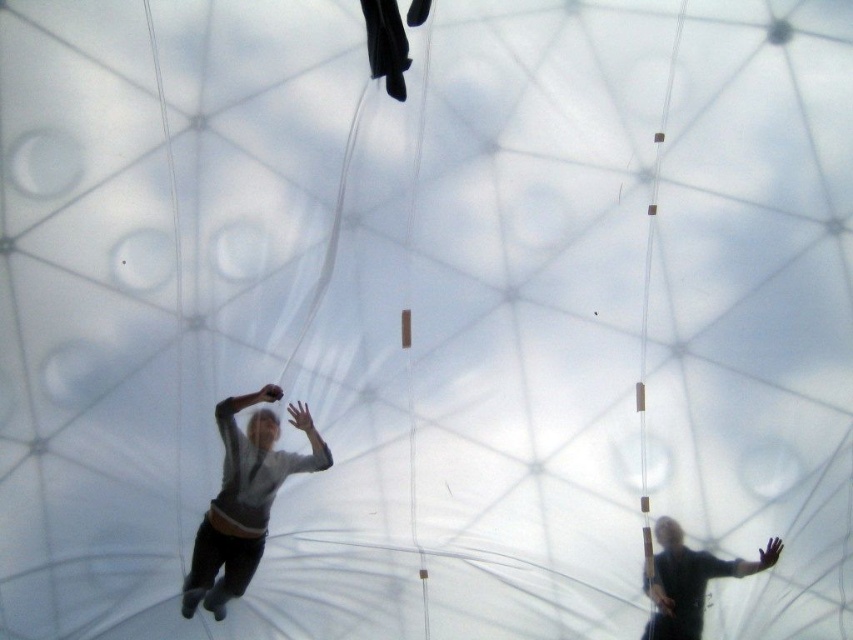
Can you confirm if light gray sweater at center is positioned above dark matte clothing at center?

Indeed, light gray sweater at center is positioned over dark matte clothing at center.

Who is taller, light gray sweater at center or dark matte clothing at center?

light gray sweater at center is taller.

Which is behind, point (230, 595) or point (683, 566)?

Positioned behind is point (230, 595).

Where is `light gray sweater at center`? This screenshot has height=640, width=853. light gray sweater at center is located at coordinates (244, 499).